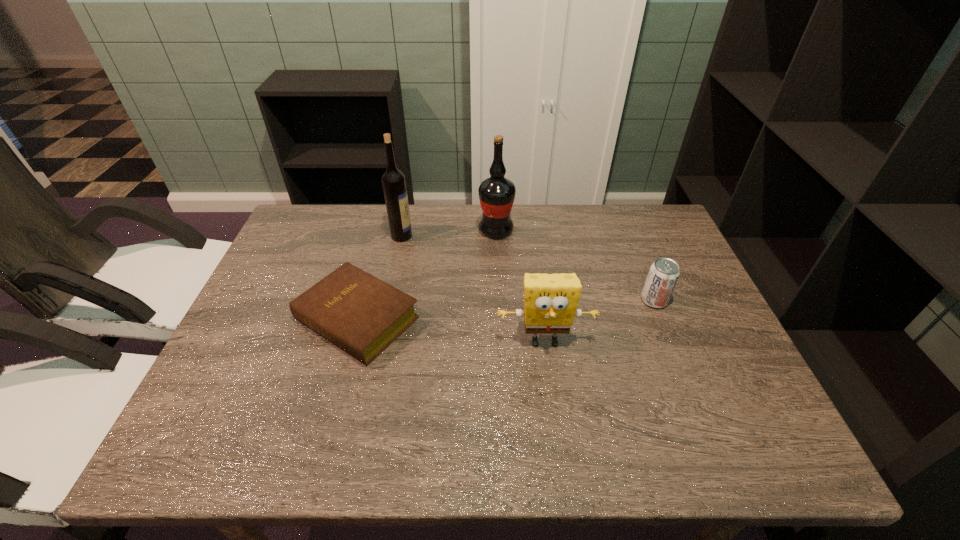
At what (x,y) coordinates should I click in order to perform the action: click on unoccupied area between the rightmost object and the Bible. Please return your answer as a coordinate pair (x, y). Image resolution: width=960 pixels, height=540 pixels. Looking at the image, I should click on (506, 309).

This screenshot has height=540, width=960. I want to click on free space that is in between the left wine bottle and the right wine bottle, so click(x=449, y=233).

You are a GUI agent. You are given a task and a screenshot of the screen. Output one action in this format:
    pyautogui.click(x=<x>, y=<y>)
    Task: Click on the vacant area that lies between the fourth tallest object and the left wine bottle
    This screenshot has height=540, width=960.
    Given the screenshot: What is the action you would take?
    pyautogui.click(x=528, y=268)

The image size is (960, 540). In order to click on free spot between the third tallest object and the Bible in this screenshot , I will do `click(451, 330)`.

Image resolution: width=960 pixels, height=540 pixels. Identify the location of free spot between the fourth tallest object and the right wine bottle. (x=575, y=265).

At what (x,y) coordinates should I click in order to perform the action: click on free area in between the second shortest object and the third tallest object. Please return your answer as a coordinate pair (x, y). Looking at the image, I should click on (599, 321).

Where is `unoccupied area between the Bible and the left wine bottle`? unoccupied area between the Bible and the left wine bottle is located at coordinates click(x=379, y=277).

The height and width of the screenshot is (540, 960). Find the location of `vacant space that is in between the left wine bottle and the third shortest object`. vacant space that is in between the left wine bottle and the third shortest object is located at coordinates (473, 288).

Where is `free space between the left wine bottle and the sponge`? The height and width of the screenshot is (540, 960). free space between the left wine bottle and the sponge is located at coordinates (473, 288).

Locate an element on the screen. The width and height of the screenshot is (960, 540). vacant area that lies between the left wine bottle and the shortest object is located at coordinates click(379, 277).